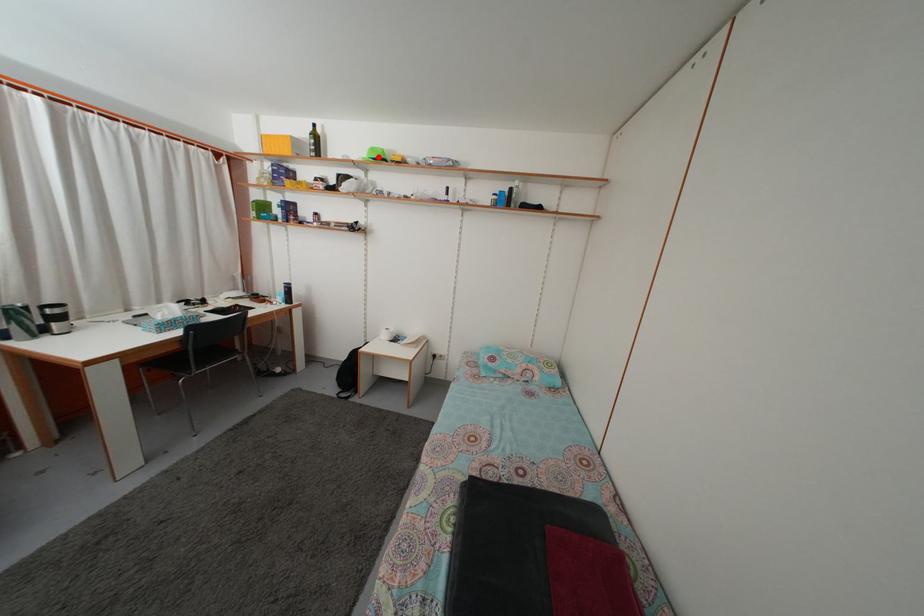
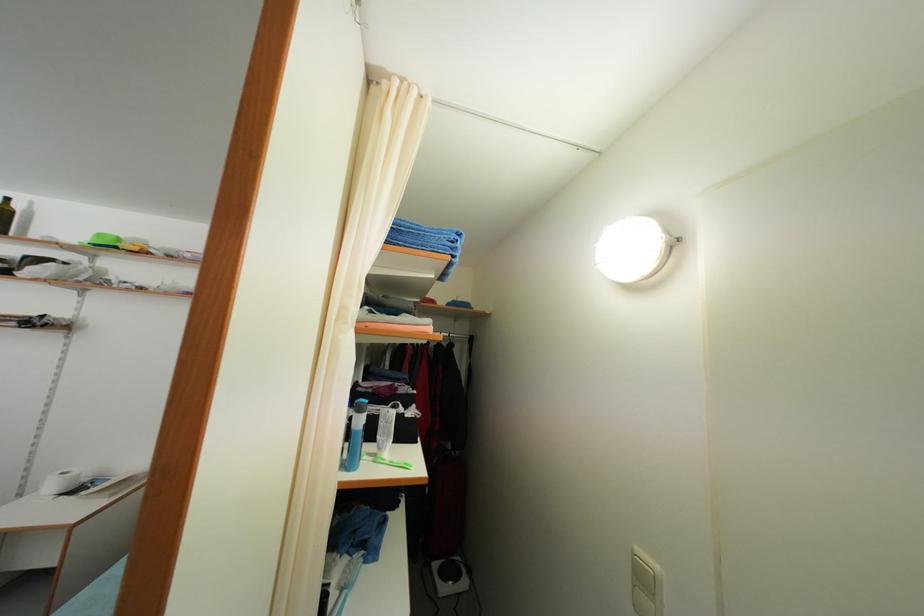
Locate, in the second image, the point that corresponds to the highlighted location in the first image.

(104, 243)